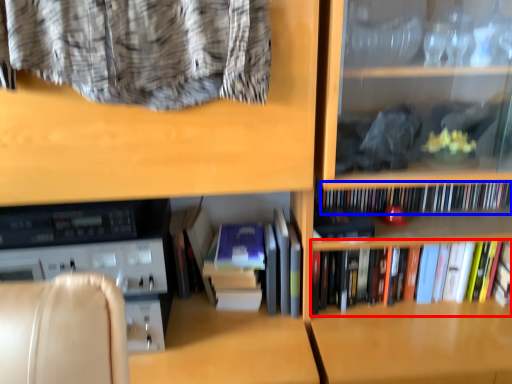
Question: Which object is further to the camera taking this photo, book (highlighted by a red box) or book (highlighted by a blue box)?

Choices:
 (A) book
 (B) book

Answer: (B)